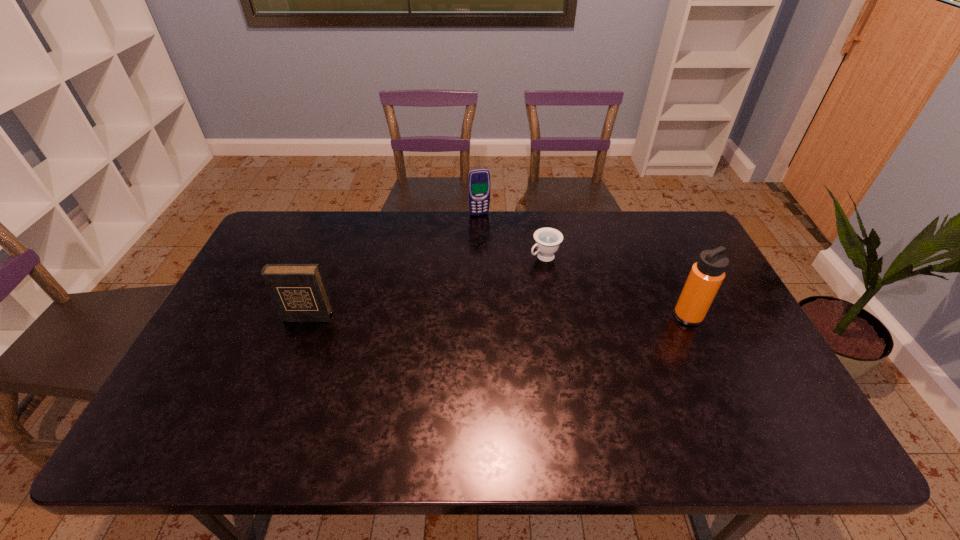
Locate an element on the screen. This screenshot has height=540, width=960. free spot at the right edge of the desktop is located at coordinates (717, 360).

In order to click on free space at the near left corner in this screenshot , I will do `click(204, 389)`.

Find the location of `blank space at the far right corner of the desktop`. blank space at the far right corner of the desktop is located at coordinates (675, 230).

Locate an element on the screen. This screenshot has width=960, height=540. vacant area at the near right corner is located at coordinates (720, 384).

This screenshot has width=960, height=540. Identify the location of free area in between the rightmost object and the third nearest object. (616, 287).

The width and height of the screenshot is (960, 540). What are the coordinates of `blank region between the rightmost object and the teacup` in the screenshot? It's located at (616, 287).

You are a GUI agent. You are given a task and a screenshot of the screen. Output one action in this format:
    pyautogui.click(x=<x>, y=<y>)
    Task: Click on the free space between the second object from right to left and the tallest object
    Image resolution: width=960 pixels, height=540 pixels.
    Given the screenshot: What is the action you would take?
    pyautogui.click(x=616, y=287)

At what (x,y) coordinates should I click in order to perform the action: click on vacant area between the second object from left to right and the leftmost object. Please return your answer as a coordinate pair (x, y). Looking at the image, I should click on (394, 266).

Identify the location of empty space that is in between the second object from right to left and the farthest object. This screenshot has height=540, width=960. (512, 235).

In order to click on free space between the shortest object and the second object from left to right in this screenshot , I will do `click(512, 235)`.